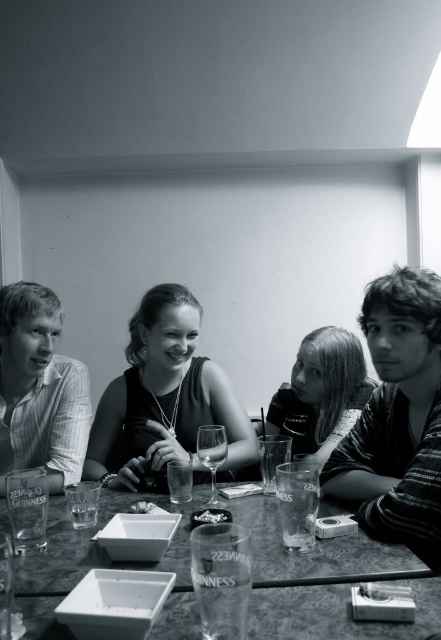
How far apart are marbled stone dining table at center and smooth black dress at center?

The distance of marbled stone dining table at center from smooth black dress at center is 15.00 inches.

Between point (134, 564) and point (183, 317), which one is positioned in front?

Positioned in front is point (134, 564).

This screenshot has height=640, width=441. In order to click on marbled stone dining table at center in this screenshot , I will do `click(97, 547)`.

Between smooth black hair at center and transparent glass wine glass at center, which one is positioned lower?

transparent glass wine glass at center

What are the coordinates of `smooth black hair at center` in the screenshot? It's located at (321, 392).

Between point (335, 420) and point (221, 445), which one is positioned in front?

Point (221, 445)

Where is `smooth black hair at center`? The height and width of the screenshot is (640, 441). smooth black hair at center is located at coordinates (321, 392).

Does smooth black dress at center lie behind transparent glass wine glass at center?

That is True.

Can you confirm if smooth black dress at center is thinner than transparent glass wine glass at center?

No.

This screenshot has width=441, height=640. What are the coordinates of `smooth black dress at center` in the screenshot? It's located at (165, 396).

Where is `smooth black dress at center`? The height and width of the screenshot is (640, 441). smooth black dress at center is located at coordinates (165, 396).